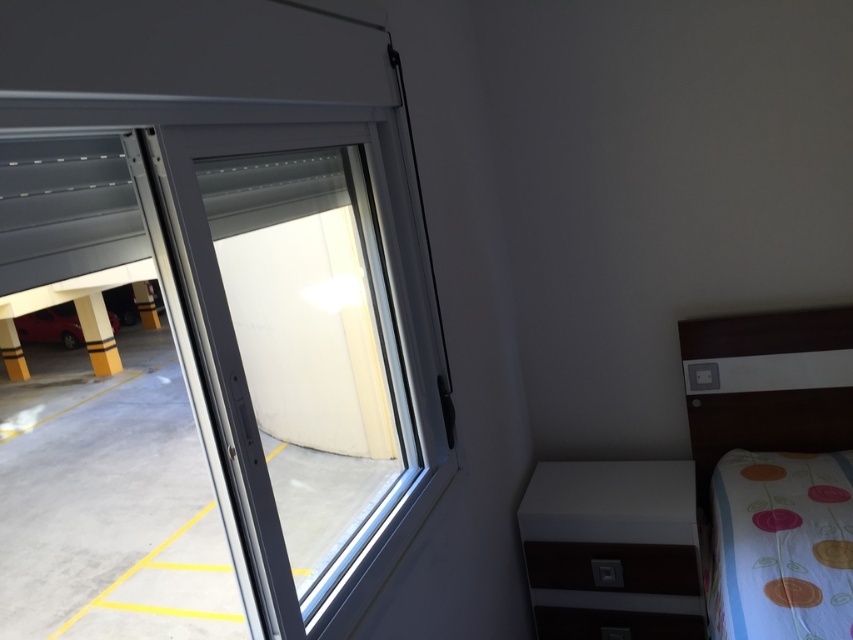
Does white plastic window at center have a lesser width compared to wooden bed at right?

No, white plastic window at center is not thinner than wooden bed at right.

Who is positioned more to the right, white plastic window at center or wooden bed at right?

From the viewer's perspective, wooden bed at right appears more on the right side.

Which is behind, point (410, 433) or point (842, 408)?

Point (842, 408)

What are the coordinates of `white plastic window at center` in the screenshot? It's located at (312, 348).

Does white plastic window at center have a lesser height compared to shiny red car at lower left?

Incorrect, white plastic window at center's height does not fall short of shiny red car at lower left's.

Is white plastic window at center bigger than shiny red car at lower left?

Indeed, white plastic window at center has a larger size compared to shiny red car at lower left.

Describe the element at coordinates (312, 348) in the screenshot. Image resolution: width=853 pixels, height=640 pixels. I see `white plastic window at center` at that location.

The width and height of the screenshot is (853, 640). Find the location of `white plastic window at center`. white plastic window at center is located at coordinates (312, 348).

Can you confirm if white glossy cabinet at lower right is bigger than shiny red car at lower left?

No.

I want to click on white glossy cabinet at lower right, so click(612, 548).

The height and width of the screenshot is (640, 853). What are the coordinates of `white glossy cabinet at lower right` in the screenshot? It's located at (612, 548).